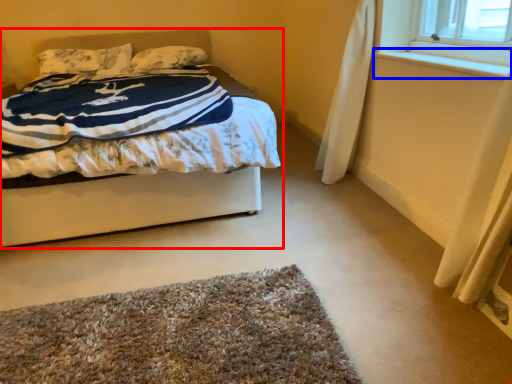
Question: Which object appears farthest to the camera in this image, bed (highlighted by a red box) or window sill (highlighted by a blue box)?

Choices:
 (A) bed
 (B) window sill

Answer: (A)